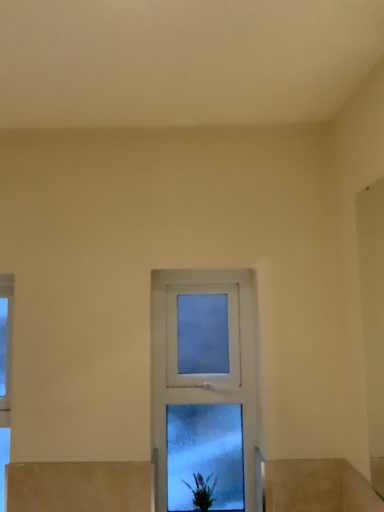
Question: Does green matte plant at lower center touch clear glass window at center?

Choices:
 (A) yes
 (B) no

Answer: (B)

Question: From the image's perspective, is green matte plant at lower center above clear glass window at center?

Choices:
 (A) yes
 (B) no

Answer: (B)

Question: Are green matte plant at lower center and clear glass window at center far apart?

Choices:
 (A) yes
 (B) no

Answer: (B)

Question: Considering the relative sizes of green matte plant at lower center and clear glass window at center in the image provided, is green matte plant at lower center taller than clear glass window at center?

Choices:
 (A) no
 (B) yes

Answer: (A)

Question: Considering the relative sizes of green matte plant at lower center and clear glass window at center in the image provided, is green matte plant at lower center wider than clear glass window at center?

Choices:
 (A) yes
 (B) no

Answer: (A)

Question: Is green matte plant at lower center closer to the viewer compared to clear glass window at center?

Choices:
 (A) yes
 (B) no

Answer: (A)

Question: From the image's perspective, is clear glass window at center beneath green matte plant at lower center?

Choices:
 (A) yes
 (B) no

Answer: (B)

Question: Considering the relative sizes of clear glass window at center and green matte plant at lower center in the image provided, is clear glass window at center bigger than green matte plant at lower center?

Choices:
 (A) yes
 (B) no

Answer: (A)

Question: Can you confirm if clear glass window at center is wider than green matte plant at lower center?

Choices:
 (A) no
 (B) yes

Answer: (A)

Question: From a real-world perspective, is clear glass window at center physically below green matte plant at lower center?

Choices:
 (A) yes
 (B) no

Answer: (B)

Question: From a real-world perspective, is clear glass window at center on top of green matte plant at lower center?

Choices:
 (A) yes
 (B) no

Answer: (A)

Question: Would you say clear glass window at center is outside green matte plant at lower center?

Choices:
 (A) no
 (B) yes

Answer: (B)

Question: From the image's perspective, is green matte plant at lower center positioned above or below clear glass window at center?

Choices:
 (A) below
 (B) above

Answer: (A)